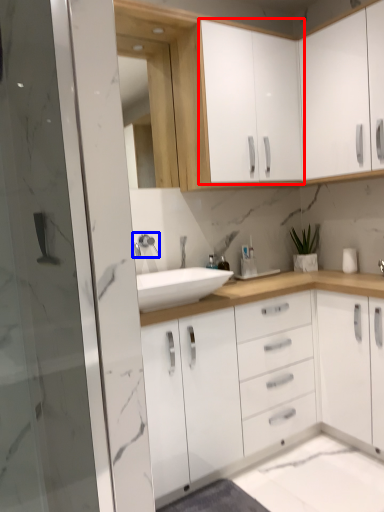
Question: Which point is closer to the camera, cabinetry (highlighted by a red box) or tap (highlighted by a blue box)?

Choices:
 (A) cabinetry
 (B) tap

Answer: (A)